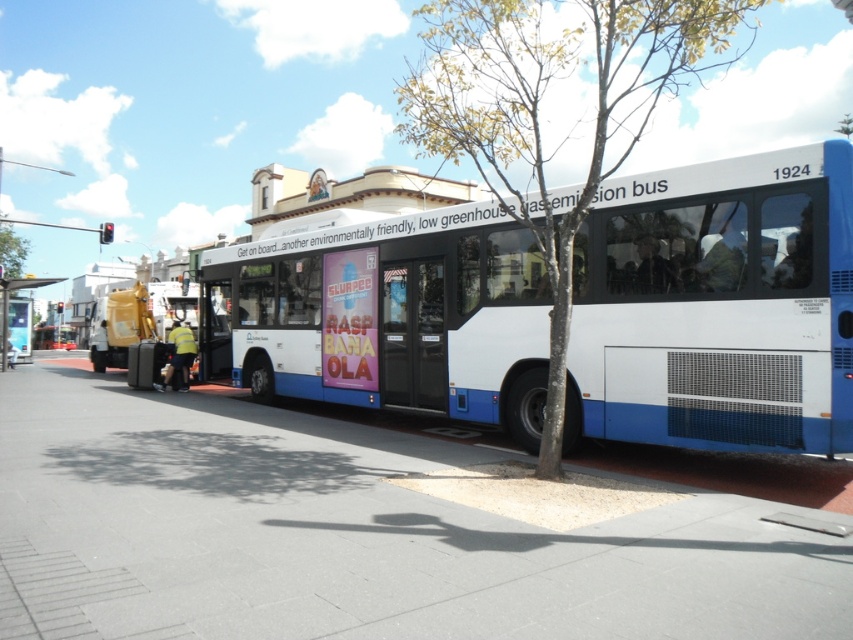
Question: Can you confirm if gray concrete pavement at center is wider than white matte bus at center?

Choices:
 (A) no
 (B) yes

Answer: (B)

Question: Can you confirm if white matte bus at center is positioned to the left of green leafy tree at center?

Choices:
 (A) yes
 (B) no

Answer: (A)

Question: Is gray concrete pavement at center bigger than metallic bus stop at left?

Choices:
 (A) yes
 (B) no

Answer: (B)

Question: Which object appears closest to the camera in this image?

Choices:
 (A) green leafy tree at center
 (B) white matte bus at center
 (C) metallic bus stop at left

Answer: (B)

Question: Which of the following is the farthest from the observer?

Choices:
 (A) white matte bus at center
 (B) green leafy tree at center
 (C) gray concrete pavement at center

Answer: (B)

Question: Which point appears farthest from the camera in this image?

Choices:
 (A) (486, 16)
 (B) (288, 368)

Answer: (B)